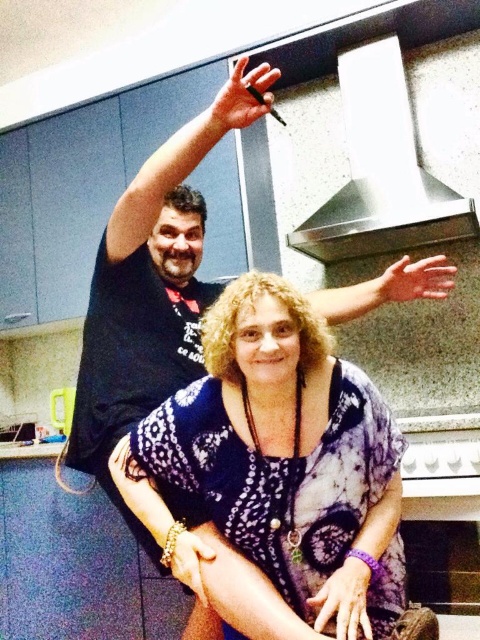
Can you confirm if dry skin at upper center is smaller than white glossy counter top at lower left?

Yes, dry skin at upper center is smaller than white glossy counter top at lower left.

Is point (396, 276) positioned behind point (25, 451)?

No, (396, 276) is in front of (25, 451).

Which is in front, point (389, 266) or point (41, 458)?

Point (41, 458)

Find the location of a particular element. This screenshot has height=640, width=480. dry skin at upper center is located at coordinates (412, 280).

Image resolution: width=480 pixels, height=640 pixels. What do you see at coordinates (385, 289) in the screenshot?
I see `smooth skin arm at center` at bounding box center [385, 289].

Between point (393, 282) and point (331, 600), which one is positioned in front?

Point (331, 600) is in front.

Locate an element on the screen. The width and height of the screenshot is (480, 640). smooth skin arm at center is located at coordinates 385,289.

Can you confirm if purple fabric hand at center is positioned below dry skin at upper center?

Yes, purple fabric hand at center is below dry skin at upper center.

Does point (321, 596) come closer to viewer compared to point (381, 288)?

That is True.

Measure the distance between purple fabric hand at center and camera.

purple fabric hand at center and camera are 1.02 meters apart from each other.

This screenshot has width=480, height=640. I want to click on purple fabric hand at center, so click(x=344, y=600).